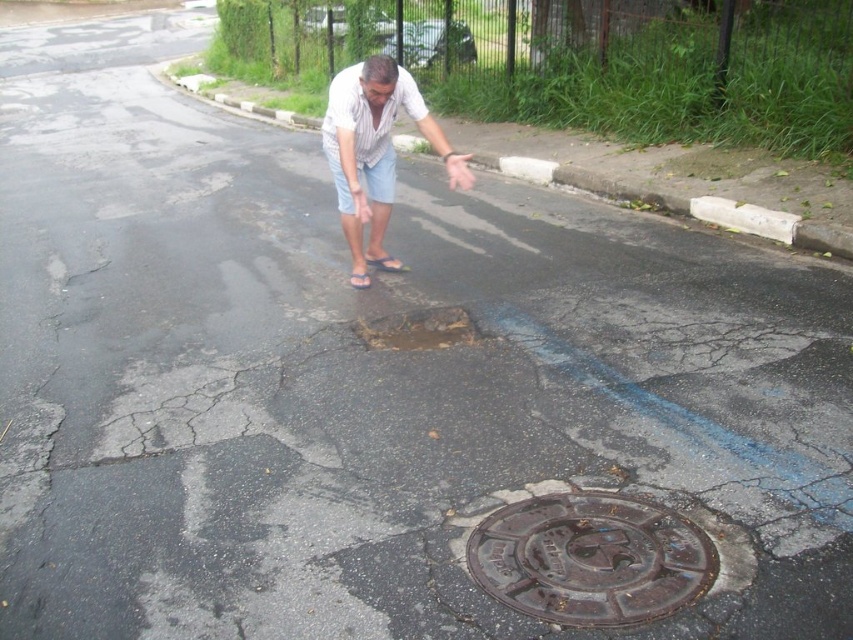
You are a pedestrian trying to cross the road safely. You see a brown textured manhole cover at center and a white striped shirt at center. Which object is closer to you?

The brown textured manhole cover at center is 3.05 meters away from the white striped shirt at center. Since the question asks which is closer to you, but the distance between them is given, we need to know your position. However, based on the description, the manhole cover and the shirt are both at the center, but the shirt is part of the man who is likely standing near the manhole cover. Assuming you are approaching from a distance, the shirt might be closer if the man is facing you. But without exact v,

You are a city inspector evaluating road conditions. You notice two manhole covers on the road surface. Which one, the brown textured manhole cover at center or the rusty metal manhole cover at center, is higher in elevation?

The brown textured manhole cover at center has a greater height compared to the rusty metal manhole cover at center, so the brown textured manhole cover at center is higher in elevation.